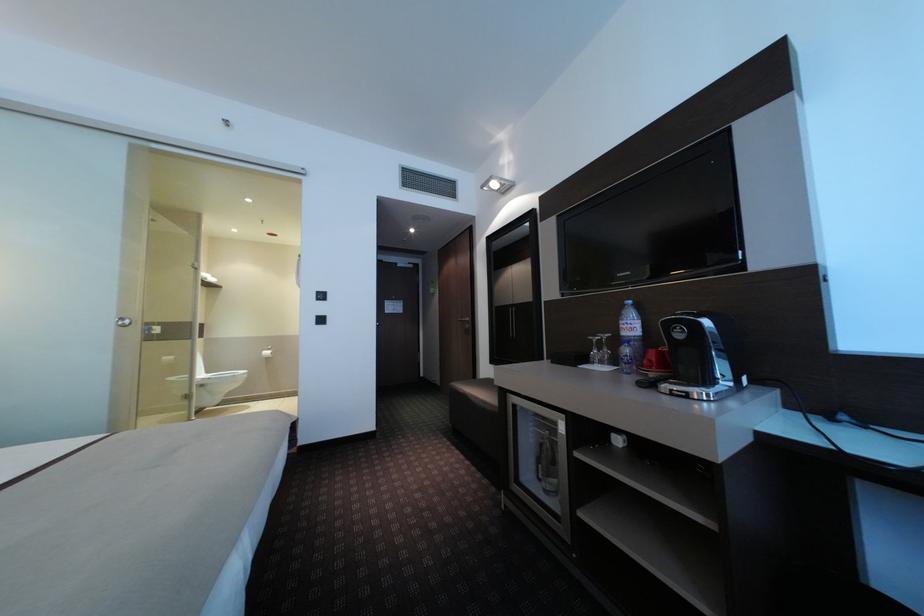
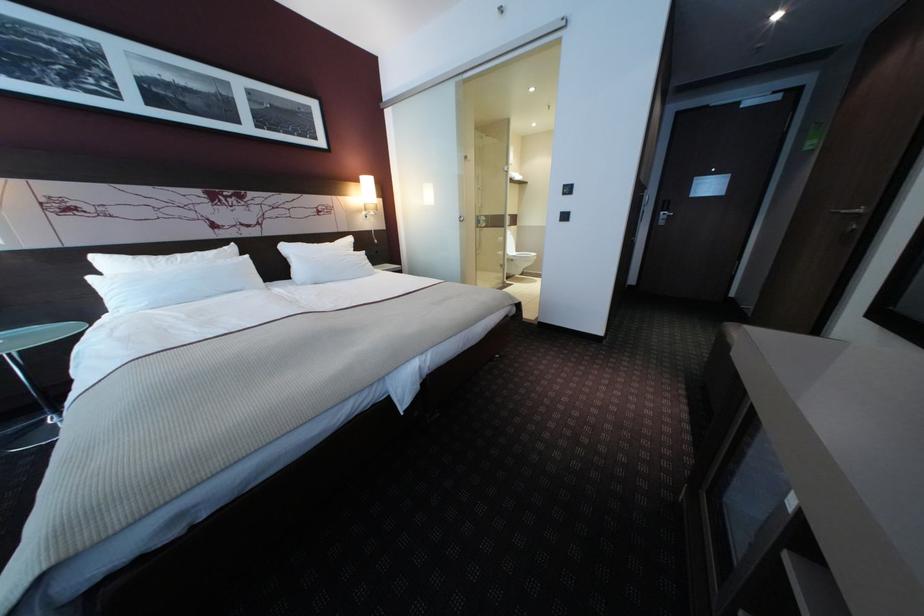
Based on the continuous images, in which direction is the camera rotating?

The camera's rotation is toward left-down.